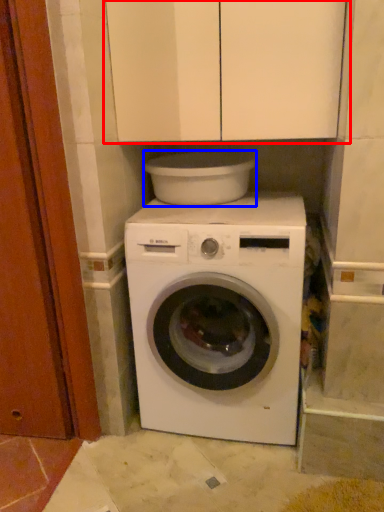
Question: Which of the following is the closest to the observer, cabinetry (highlighted by a red box) or appliance (highlighted by a blue box)?

Choices:
 (A) cabinetry
 (B) appliance

Answer: (A)